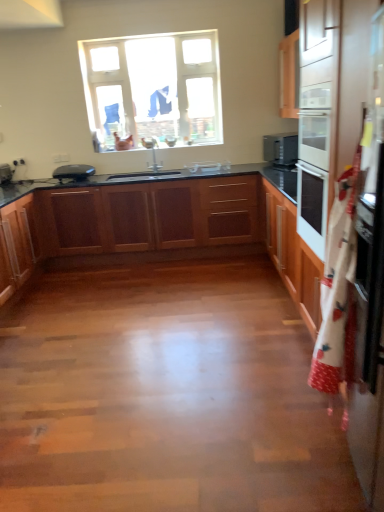
Question: From the image's perspective, is clear glass window at upper center on top of wooden cabinets at center, marked as the first cabinetry in a back-to-front arrangement?

Choices:
 (A) yes
 (B) no

Answer: (A)

Question: Does clear glass window at upper center turn towards wooden cabinets at center, the 3th cabinetry viewed from the front?

Choices:
 (A) no
 (B) yes

Answer: (A)

Question: Is clear glass window at upper center completely or partially outside of wooden cabinets at center, marked as the first cabinetry in a back-to-front arrangement?

Choices:
 (A) no
 (B) yes

Answer: (B)

Question: From a real-world perspective, is clear glass window at upper center under wooden cabinets at center, marked as the first cabinetry in a back-to-front arrangement?

Choices:
 (A) no
 (B) yes

Answer: (A)

Question: Considering the relative positions of clear glass window at upper center and wooden cabinets at center, marked as the first cabinetry in a back-to-front arrangement, in the image provided, is clear glass window at upper center to the right of wooden cabinets at center, marked as the first cabinetry in a back-to-front arrangement, from the viewer's perspective?

Choices:
 (A) yes
 (B) no

Answer: (A)

Question: Considering the relative positions of white fabric apron at right and wooden cabinets at center, which is counted as the first cabinetry, starting from the front, in the image provided, is white fabric apron at right to the left or to the right of wooden cabinets at center, which is counted as the first cabinetry, starting from the front,?

Choices:
 (A) right
 (B) left

Answer: (A)

Question: Relative to wooden cabinets at center, which is counted as the first cabinetry, starting from the front, is white fabric apron at right in front or behind?

Choices:
 (A) behind
 (B) front

Answer: (B)

Question: Does point (380, 298) appear closer or farther from the camera than point (3, 205)?

Choices:
 (A) farther
 (B) closer

Answer: (B)

Question: From a real-world perspective, is white fabric apron at right physically located above or below wooden cabinets at center, positioned as the 3th cabinetry in back-to-front order?

Choices:
 (A) below
 (B) above

Answer: (B)

Question: Considering their positions, is satin black microwave at upper right located in front of or behind wooden cabinets at center, which is counted as the first cabinetry, starting from the front?

Choices:
 (A) front
 (B) behind

Answer: (B)

Question: Based on their sizes in the image, would you say satin black microwave at upper right is bigger or smaller than wooden cabinets at center, which is counted as the first cabinetry, starting from the front?

Choices:
 (A) small
 (B) big

Answer: (A)

Question: Considering the relative positions of satin black microwave at upper right and wooden cabinets at center, positioned as the 3th cabinetry in back-to-front order, in the image provided, is satin black microwave at upper right to the left or to the right of wooden cabinets at center, positioned as the 3th cabinetry in back-to-front order,?

Choices:
 (A) left
 (B) right

Answer: (B)

Question: From a real-world perspective, is satin black microwave at upper right physically located above or below wooden cabinets at center, which is counted as the first cabinetry, starting from the front?

Choices:
 (A) above
 (B) below

Answer: (A)

Question: Based on their sizes in the image, would you say clear glass window at upper center is bigger or smaller than wooden cabinets at center, marked as the first cabinetry in a back-to-front arrangement?

Choices:
 (A) small
 (B) big

Answer: (A)

Question: Considering their positions, is clear glass window at upper center located in front of or behind wooden cabinets at center, the 3th cabinetry viewed from the front?

Choices:
 (A) front
 (B) behind

Answer: (B)